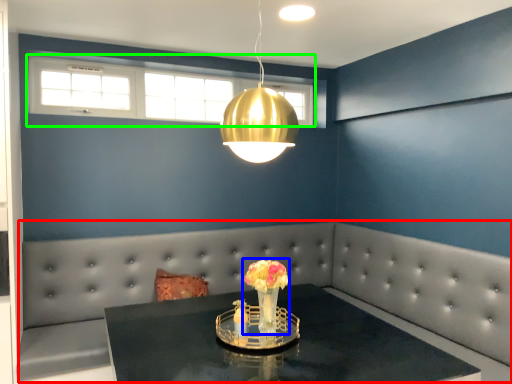
Question: Estimate the real-world distances between objects in this image. Which object is farther from couch (highlighted by a red box), floral arrangement (highlighted by a blue box) or window (highlighted by a green box)?

Choices:
 (A) floral arrangement
 (B) window

Answer: (A)